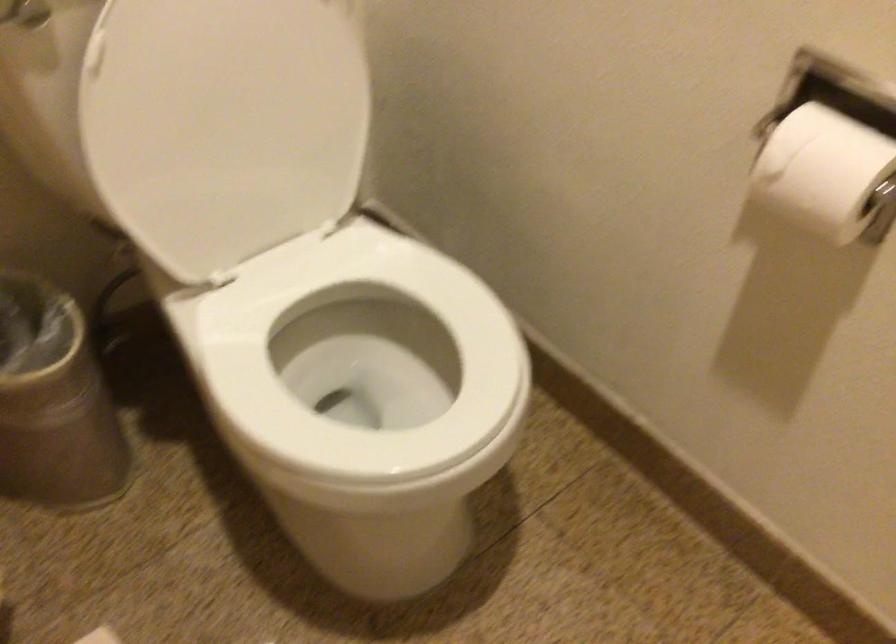
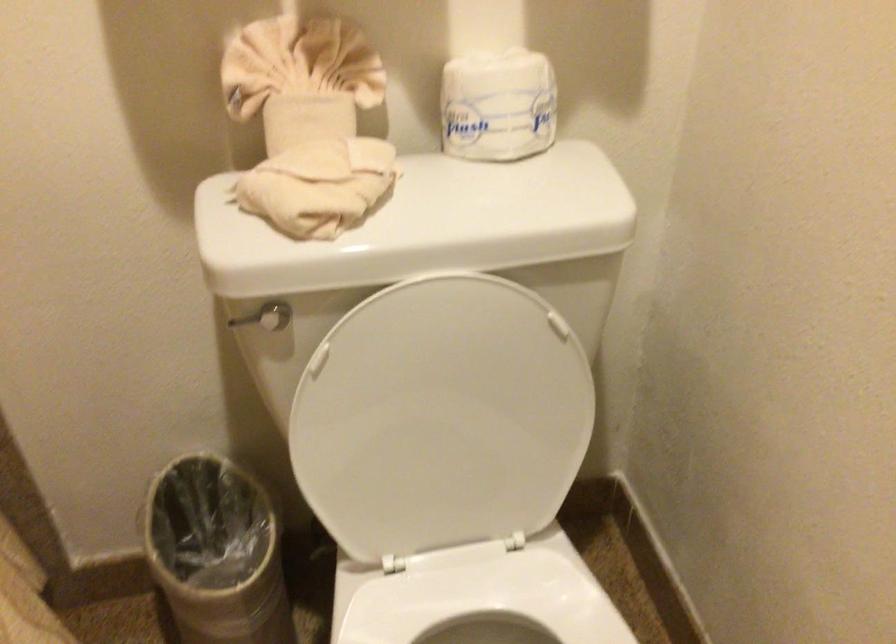
In a continuous first-person perspective shot, in which direction is the camera moving?

The movement direction of the cameraman is right, forward.